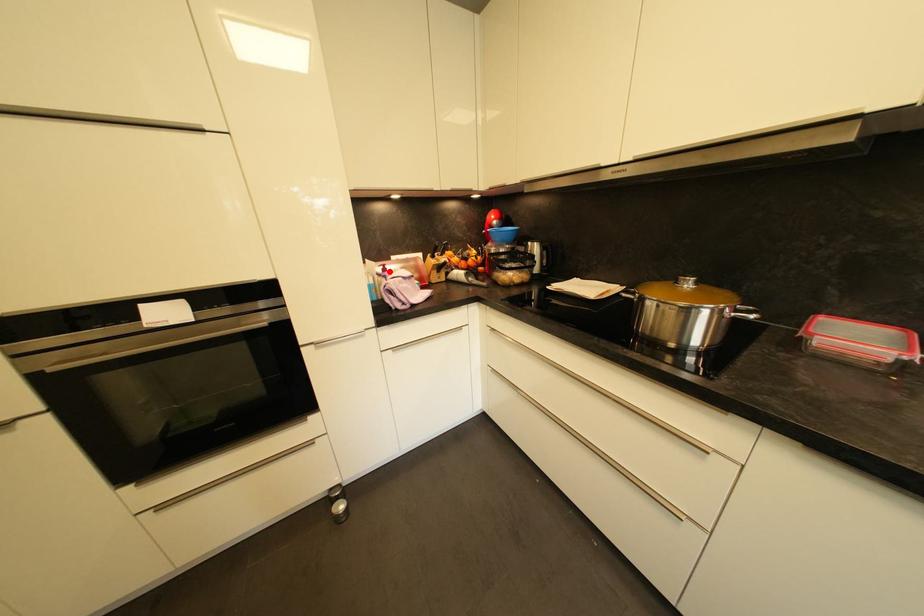
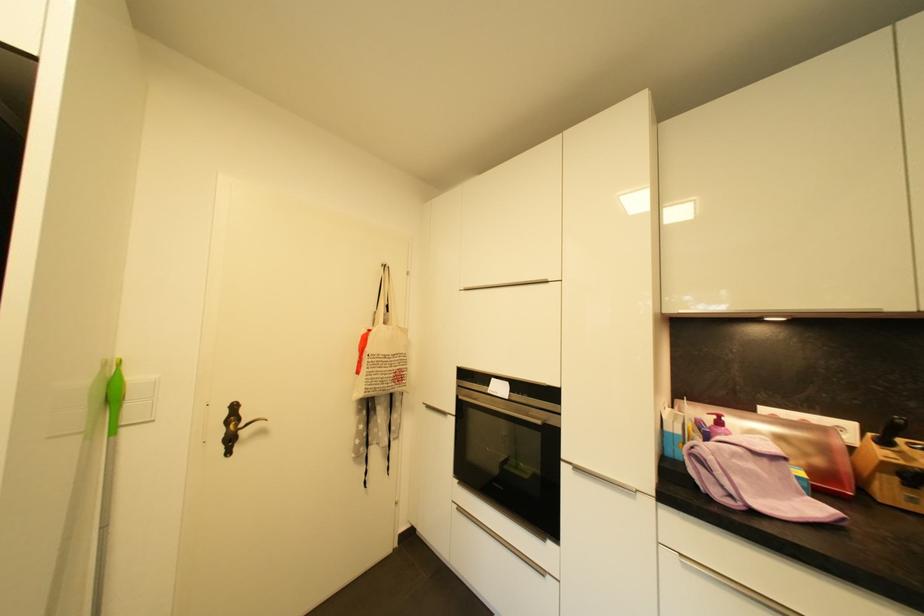
Locate, in the second image, the point that corresponds to the highlighted location in the first image.

(724, 424)